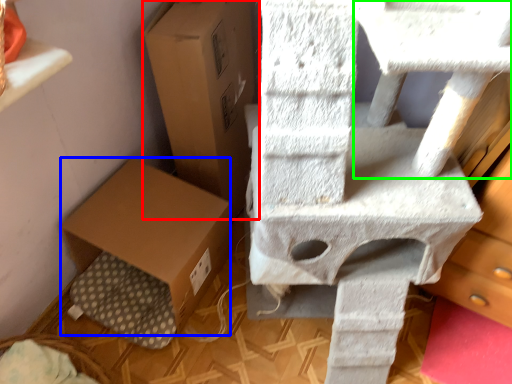
Question: Considering the real-world distances, which object is farthest from cardboard box (highlighted by a red box)? cardboard box (highlighted by a blue box) or table (highlighted by a green box)?

Choices:
 (A) cardboard box
 (B) table

Answer: (B)